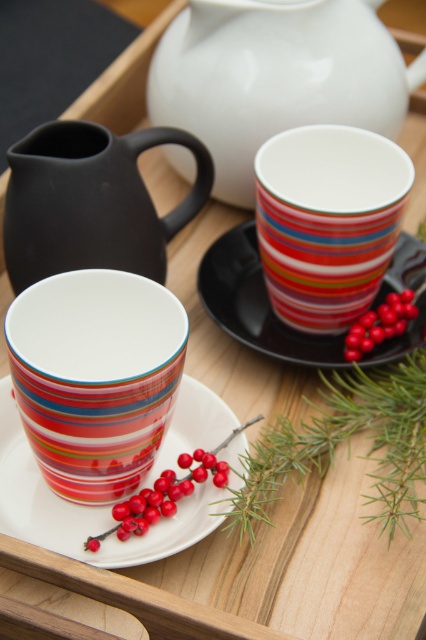
You are arranging items on a wooden tray for a festive display. You have a matte ceramic mug at center. Where should you place it to ensure it aligns with the existing setup described in the scene?

The matte ceramic mug at center should be placed at point (95, 378) as specified in the Objects Description to align with the existing setup.

You are arranging a festive table and need to place a decoration between the matte black pitcher at upper left and the white ceramic plate at center. Based on their positions, which object should the decoration be closer to?

→ The decoration should be closer to the white ceramic plate at center because the matte black pitcher at upper left is further away from the viewer, meaning the plate is positioned closer to the front of the scene.

You are arranging a festive table and need to place a decorative item on top of the black glossy saucer at center. However, you also want to ensure that the glossy red berries at center right remain visible. Can you place the item without covering the berries?

Yes, since the black glossy saucer at center is above the glossy red berries at center right, placing an item on the saucer will not cover the berries as they are positioned below.